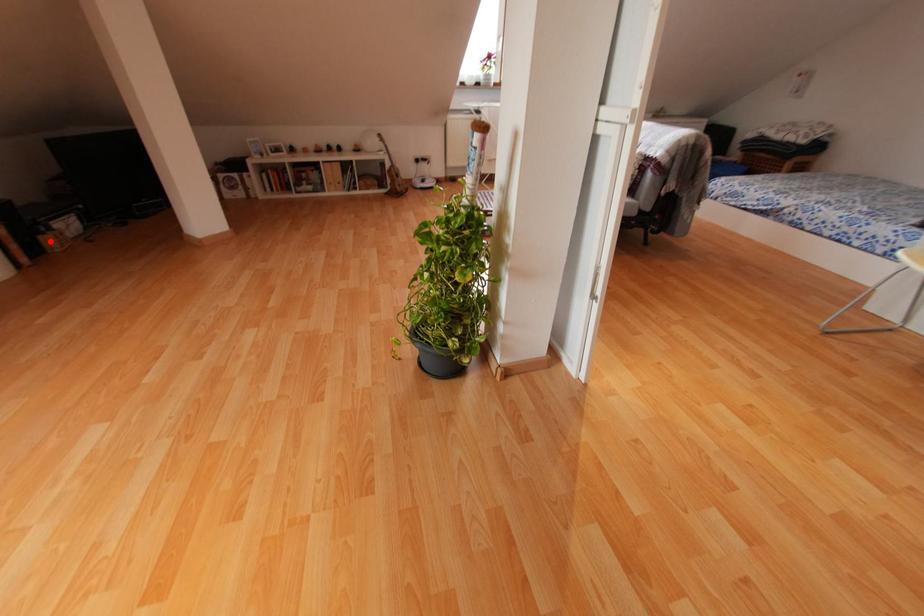
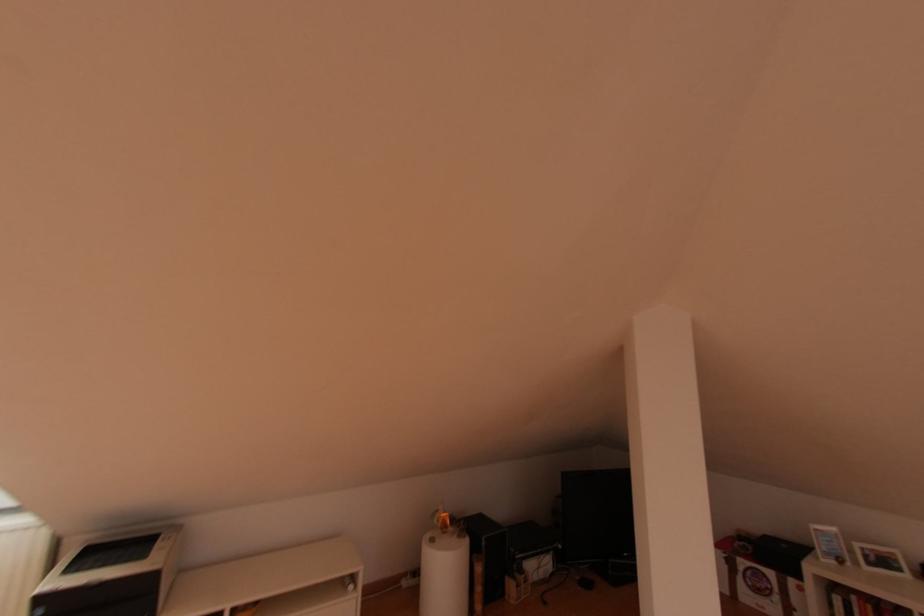
Locate, in the second image, the point that corresponds to the highlighted location in the first image.

(511, 589)